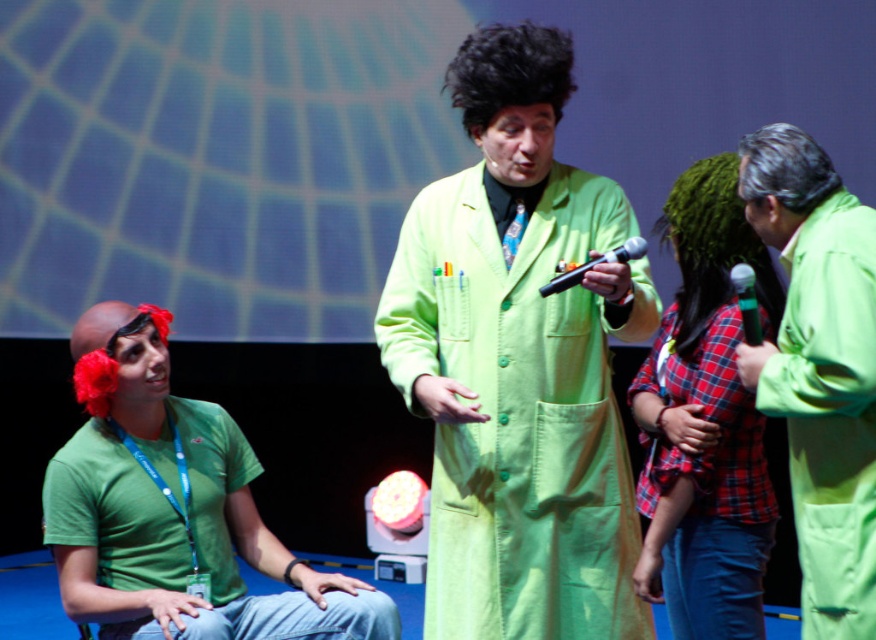
Does lime green lab coat at center appear under green matte coat at right?

No.

Between lime green lab coat at center and green matte coat at right, which one is positioned higher?

lime green lab coat at center is above.

The height and width of the screenshot is (640, 876). Describe the element at coordinates (519, 362) in the screenshot. I see `lime green lab coat at center` at that location.

Where is `lime green lab coat at center`? lime green lab coat at center is located at coordinates (519, 362).

Looking at this image, measure the distance from green matte t-shirt at lower left to black matte microphone at center.

green matte t-shirt at lower left and black matte microphone at center are 1.22 meters apart from each other.

Who is more distant from viewer, (210, 568) or (592, 259)?

The point (210, 568) is behind.

The width and height of the screenshot is (876, 640). What do you see at coordinates (244, 534) in the screenshot?
I see `green matte t-shirt at lower left` at bounding box center [244, 534].

You are a GUI agent. You are given a task and a screenshot of the screen. Output one action in this format:
    pyautogui.click(x=<x>, y=<y>)
    Task: Click on the green matte t-shirt at lower left
    
    Given the screenshot: What is the action you would take?
    pyautogui.click(x=244, y=534)

Does lime green lab coat at center lie in front of red plaid shirt at center?

Yes, lime green lab coat at center is in front of red plaid shirt at center.

Is lime green lab coat at center wider than red plaid shirt at center?

Correct, the width of lime green lab coat at center exceeds that of red plaid shirt at center.

This screenshot has height=640, width=876. What do you see at coordinates (519, 362) in the screenshot? I see `lime green lab coat at center` at bounding box center [519, 362].

At what (x,y) coordinates should I click in order to perform the action: click on lime green lab coat at center. Please return your answer as a coordinate pair (x, y). Looking at the image, I should click on (519, 362).